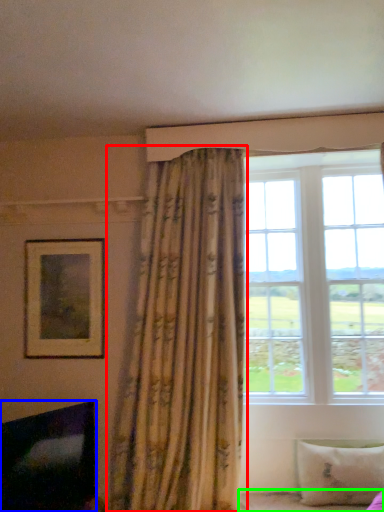
Question: Which object is the farthest from curtain (highlighted by a red box)? Choose among these: fireplace (highlighted by a blue box) or bed frame (highlighted by a green box).

Choices:
 (A) fireplace
 (B) bed frame

Answer: (B)